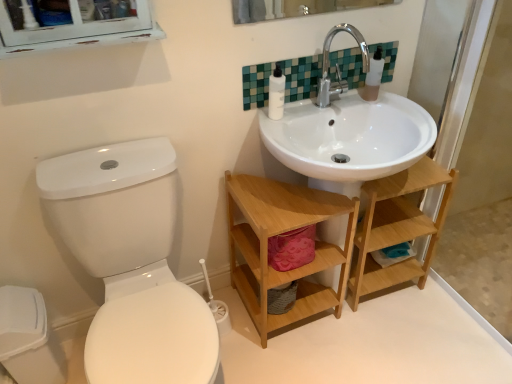
What do you see at coordinates (131, 262) in the screenshot? I see `white glossy toilet at left` at bounding box center [131, 262].

Find the location of a particular element. transparent plastic soap dispenser at upper right is located at coordinates (373, 77).

Image resolution: width=512 pixels, height=384 pixels. In order to click on transparent glass screen door at right in this screenshot , I will do `click(482, 175)`.

Is green mosaic tile at upper center at the back of white matte toilet paper at lower right?

No.

Considering the relative sizes of white matte toilet paper at lower right and green mosaic tile at upper center in the image provided, is white matte toilet paper at lower right taller than green mosaic tile at upper center?

Incorrect, the height of white matte toilet paper at lower right is not larger of that of green mosaic tile at upper center.

Is point (393, 246) behind point (294, 89)?

Yes.

From the image's perspective, which is below, white glossy toilet at left or silver metallic faucet at upper center?

white glossy toilet at left, from the image's perspective.

Is white glossy toilet at left in front of or behind silver metallic faucet at upper center in the image?

white glossy toilet at left is in front of silver metallic faucet at upper center.

From a real-world perspective, who is located lower, white glossy toilet at left or silver metallic faucet at upper center?

white glossy toilet at left.

Does silver metallic faucet at upper center appear on the right side of transparent plastic soap dispenser at upper right?

No.

Considering the relative sizes of silver metallic faucet at upper center and transparent plastic soap dispenser at upper right in the image provided, is silver metallic faucet at upper center thinner than transparent plastic soap dispenser at upper right?

In fact, silver metallic faucet at upper center might be wider than transparent plastic soap dispenser at upper right.

In terms of height, does silver metallic faucet at upper center look taller or shorter compared to transparent plastic soap dispenser at upper right?

Clearly, silver metallic faucet at upper center is taller compared to transparent plastic soap dispenser at upper right.

Is silver metallic faucet at upper center not close to transparent plastic soap dispenser at upper right?

No, silver metallic faucet at upper center is in close proximity to transparent plastic soap dispenser at upper right.

Which is further, (130, 158) or (505, 273)?

Positioned behind is point (505, 273).

Between white glossy toilet at left and transparent glass screen door at right, which one appears on the left side from the viewer's perspective?

white glossy toilet at left.

From the image's perspective, which is below, white glossy toilet at left or transparent glass screen door at right?

From the image's view, white glossy toilet at left is below.

Which of these two, white glossy toilet at left or transparent glass screen door at right, is wider?

With larger width is white glossy toilet at left.

From the image's perspective, is white plastic bottle at upper center located above or below wooden shelf at lower center, marked as the 2th shelf in a right-to-left arrangement?

white plastic bottle at upper center is situated higher than wooden shelf at lower center, marked as the 2th shelf in a right-to-left arrangement, in the image.

Is white plastic bottle at upper center taller or shorter than wooden shelf at lower center, acting as the first shelf starting from the left?

Considering their sizes, white plastic bottle at upper center has less height than wooden shelf at lower center, acting as the first shelf starting from the left.

Which is more to the left, white plastic bottle at upper center or wooden shelf at lower center, acting as the first shelf starting from the left?

white plastic bottle at upper center.

Does point (273, 78) come behind point (261, 296)?

No, it is not.

Which is in front, wooden shelf at lower center, acting as the first shelf starting from the left, or white plastic bottle at upper center?

wooden shelf at lower center, acting as the first shelf starting from the left, is in front.

From the image's perspective, is wooden shelf at lower center, marked as the 2th shelf in a right-to-left arrangement, above white plastic bottle at upper center?

No, from the image's perspective, wooden shelf at lower center, marked as the 2th shelf in a right-to-left arrangement, is not above white plastic bottle at upper center.

Identify the location of the 2nd shelf below the white plastic bottle at upper center (from the image's perspective). The width and height of the screenshot is (512, 384). (280, 233).

Is white glossy toilet at left surrounding green mosaic tile at upper center?

No, green mosaic tile at upper center is located outside of white glossy toilet at left.

Which is more to the right, white glossy toilet at left or green mosaic tile at upper center?

From the viewer's perspective, green mosaic tile at upper center appears more on the right side.

Between white glossy toilet at left and green mosaic tile at upper center, which one is positioned behind?

green mosaic tile at upper center.

Is white glossy toilet at left aimed at green mosaic tile at upper center?

No, white glossy toilet at left is not aimed at green mosaic tile at upper center.

Identify the location of tile that appears on the left of white matte toilet paper at lower right. Image resolution: width=512 pixels, height=384 pixels. (286, 80).

Where is `toilet located below the silver metallic faucet at upper center (from the image's perspective)`? This screenshot has width=512, height=384. toilet located below the silver metallic faucet at upper center (from the image's perspective) is located at coordinates (131, 262).

When comparing their distances from wooden shelf at lower right, the first shelf from the right, does wooden shelf at lower center, marked as the 2th shelf in a right-to-left arrangement, or white glossy toilet at left seem further?

The object further to wooden shelf at lower right, the first shelf from the right, is white glossy toilet at left.

Consider the image. When comparing their distances from white matte toilet paper at lower right, does transparent plastic soap dispenser at upper right or wooden shelf at lower center, acting as the first shelf starting from the left, seem further?

The object further to white matte toilet paper at lower right is transparent plastic soap dispenser at upper right.

Considering their positions, is transparent glass screen door at right positioned closer to wooden shelf at lower right, acting as the 2th shelf starting from the left, than transparent plastic soap dispenser at upper right?

transparent glass screen door at right.

From the picture: Considering their positions, is wooden shelf at lower right, acting as the 2th shelf starting from the left, positioned further to white matte toilet paper at lower right than white plastic bottle at upper center?

white plastic bottle at upper center.

Which object lies further to the anchor point wooden shelf at lower right, the first shelf from the right, silver metallic faucet at upper center or transparent plastic soap dispenser at upper right?

Based on the image, silver metallic faucet at upper center appears to be further to wooden shelf at lower right, the first shelf from the right.

Based on their spatial positions, is white glossy toilet at left or wooden shelf at lower right, the first shelf from the right, further from transparent glass screen door at right?

Based on the image, white glossy toilet at left appears to be further to transparent glass screen door at right.

Considering their positions, is white plastic bottle at upper center positioned closer to white matte toilet paper at lower right than wooden shelf at lower center, marked as the 2th shelf in a right-to-left arrangement?

Based on the image, wooden shelf at lower center, marked as the 2th shelf in a right-to-left arrangement, appears to be nearer to white matte toilet paper at lower right.

From the image, which object appears to be farther from white plastic bottle at upper center, wooden shelf at lower center, marked as the 2th shelf in a right-to-left arrangement, or white matte toilet paper at lower right?

Among the two, white matte toilet paper at lower right is located further to white plastic bottle at upper center.

Find the location of a particular element. toiletry between silver metallic faucet at upper center and wooden shelf at lower right, the first shelf from the right, in the vertical direction is located at coordinates (276, 94).

Where is `tap between white glossy toilet at left and white matte toilet paper at lower right in the front-back direction`? The width and height of the screenshot is (512, 384). tap between white glossy toilet at left and white matte toilet paper at lower right in the front-back direction is located at coordinates (328, 65).

This screenshot has height=384, width=512. Find the location of `tile situated between wooden shelf at lower center, acting as the first shelf starting from the left, and transparent glass screen door at right from left to right`. tile situated between wooden shelf at lower center, acting as the first shelf starting from the left, and transparent glass screen door at right from left to right is located at coordinates (286, 80).

Where is `tap between wooden shelf at lower center, marked as the 2th shelf in a right-to-left arrangement, and transparent glass screen door at right, in the horizontal direction`? tap between wooden shelf at lower center, marked as the 2th shelf in a right-to-left arrangement, and transparent glass screen door at right, in the horizontal direction is located at coordinates (328, 65).